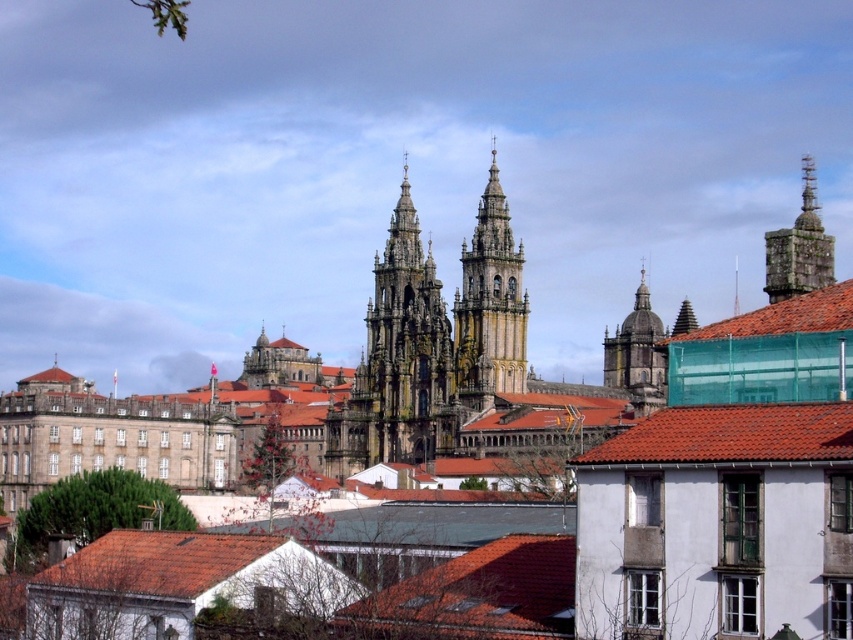
Looking at this image, can you confirm if red tile roof at center is wider than stone steeple at upper right?

Incorrect, red tile roof at center's width does not surpass stone steeple at upper right's.

Describe the element at coordinates (476, 595) in the screenshot. I see `red tile roof at center` at that location.

The width and height of the screenshot is (853, 640). What are the coordinates of `red tile roof at center` in the screenshot? It's located at (476, 595).

Based on the photo, measure the distance between brown tile roof at lower right and camera.

brown tile roof at lower right is 196.62 feet away from camera.

Between brown tile roof at lower right and red tile roof at upper center, which one is positioned lower?

brown tile roof at lower right is lower down.

Describe the element at coordinates (730, 435) in the screenshot. I see `brown tile roof at lower right` at that location.

Find the location of a particular element. This screenshot has width=853, height=640. brown tile roof at lower right is located at coordinates (730, 435).

Can you confirm if stone gothic cathedral at center is smaller than brown tile roof at lower left?

Incorrect, stone gothic cathedral at center is not smaller in size than brown tile roof at lower left.

Is point (409, 388) farther from camera compared to point (125, 557)?

Yes, it is behind point (125, 557).

I want to click on stone gothic cathedral at center, so click(x=399, y=362).